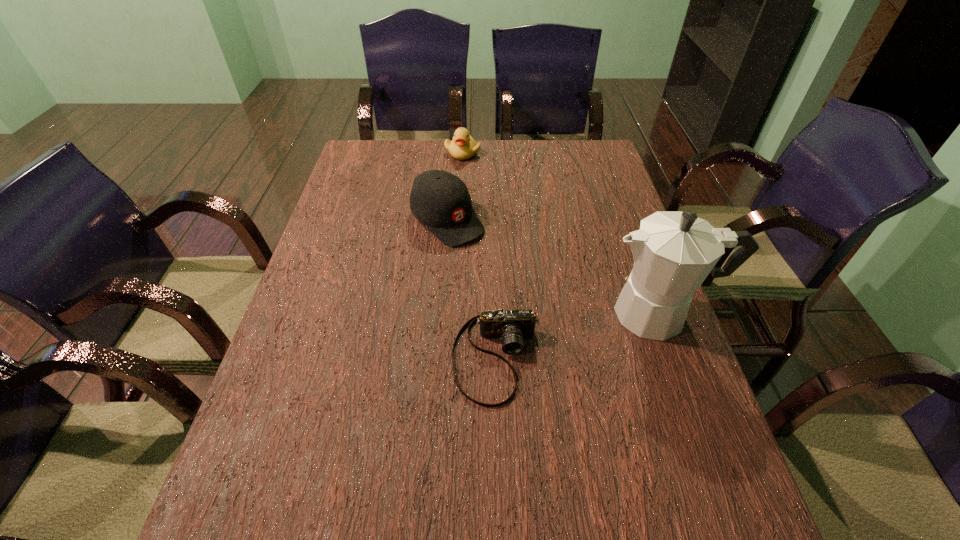
The width and height of the screenshot is (960, 540). I want to click on vacant position at the left edge of the desktop, so click(x=284, y=393).

This screenshot has height=540, width=960. I want to click on free space at the right edge, so click(584, 215).

Where is `free spot at the far left corner of the desktop`? free spot at the far left corner of the desktop is located at coordinates (398, 152).

The height and width of the screenshot is (540, 960). I want to click on free space at the far right corner, so click(564, 140).

I want to click on vacant area that lies between the shortest object and the rightmost object, so [x=578, y=335].

You are a GUI agent. You are given a task and a screenshot of the screen. Output one action in this format:
    pyautogui.click(x=<x>, y=<y>)
    Task: Click on the empty space between the coffeepot and the baseball cap
    Image resolution: width=960 pixels, height=540 pixels.
    Given the screenshot: What is the action you would take?
    pyautogui.click(x=554, y=267)

Where is `free space between the tallest object and the shortest object`? free space between the tallest object and the shortest object is located at coordinates (578, 335).

In order to click on blank region between the second shortest object and the tallest object in this screenshot , I will do `click(562, 233)`.

The image size is (960, 540). Identify the location of vacant space in between the farthest object and the tallest object. (562, 233).

Where is `unoccupied position between the second shortest object and the tallest object`? This screenshot has width=960, height=540. unoccupied position between the second shortest object and the tallest object is located at coordinates (562, 233).